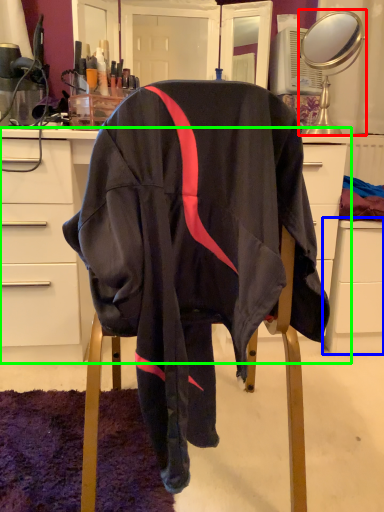
Question: Considering the real-world distances, which object is closest to mirror (highlighted by a red box)? file cabinet (highlighted by a blue box) or desk (highlighted by a green box).

Choices:
 (A) file cabinet
 (B) desk

Answer: (A)